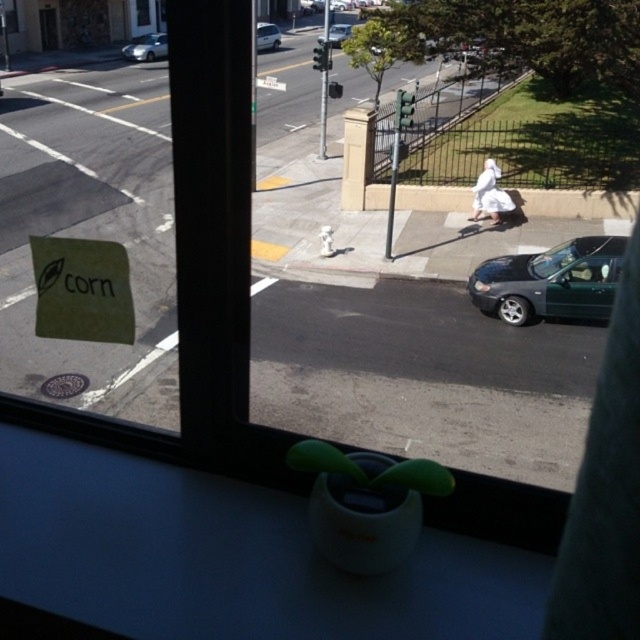
Which is more to the left, green matte car at lower right or matte paper sign at lower left?

From the viewer's perspective, matte paper sign at lower left appears more on the left side.

Is green matte car at lower right above matte paper sign at lower left?

Yes, green matte car at lower right is above matte paper sign at lower left.

Between point (545, 316) and point (118, 342), which one is positioned in front?

Point (118, 342)

Locate an element on the screen. This screenshot has height=640, width=640. green matte car at lower right is located at coordinates (550, 282).

Between silver metallic sedan at upper left and metallic silver sedan at center, which one appears on the left side from the viewer's perspective?

silver metallic sedan at upper left

Is point (157, 33) farther from viewer compared to point (348, 29)?

Yes, it is behind point (348, 29).

This screenshot has width=640, height=640. What are the coordinates of `silver metallic sedan at upper left` in the screenshot? It's located at (147, 48).

Is matte paper sign at lower left taller than silver metallic sedan at upper left?

In fact, matte paper sign at lower left may be shorter than silver metallic sedan at upper left.

Is matte paper sign at lower left closer to the viewer compared to silver metallic sedan at upper left?

Yes.

Between point (100, 316) and point (125, 52), which one is positioned in front?

Point (100, 316) is in front.

Locate an element on the screen. The width and height of the screenshot is (640, 640). matte paper sign at lower left is located at coordinates tap(81, 289).